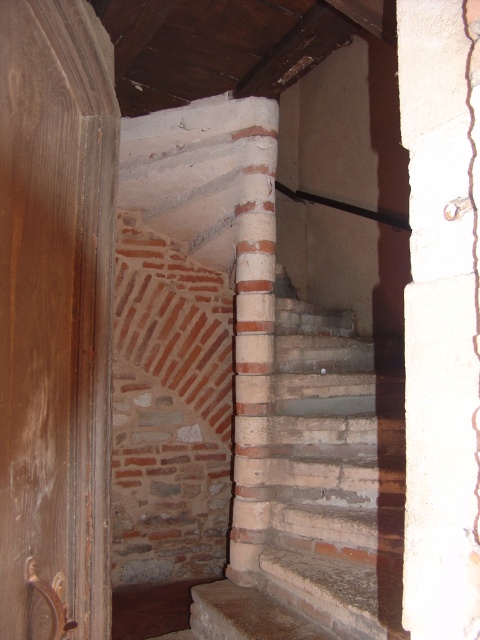
Question: From the image, what is the correct spatial relationship of brown wood door at left in relation to stone textured stairs at center?

Choices:
 (A) left
 (B) right

Answer: (A)

Question: Is brown wood door at left to the left of stone textured stairs at center from the viewer's perspective?

Choices:
 (A) no
 (B) yes

Answer: (B)

Question: Considering the real-world distances, which object is farthest from the brown wood door at left?

Choices:
 (A) white concrete pillar at right
 (B) stone textured stairs at center

Answer: (B)

Question: Which of the following is the closest to the observer?

Choices:
 (A) stone textured stairs at center
 (B) brown wood door at left

Answer: (B)

Question: Which point is farther from the camera taking this photo?

Choices:
 (A) (342, 481)
 (B) (443, 532)
 (C) (29, 49)

Answer: (A)

Question: Is stone textured stairs at center behind white concrete pillar at right?

Choices:
 (A) no
 (B) yes

Answer: (B)